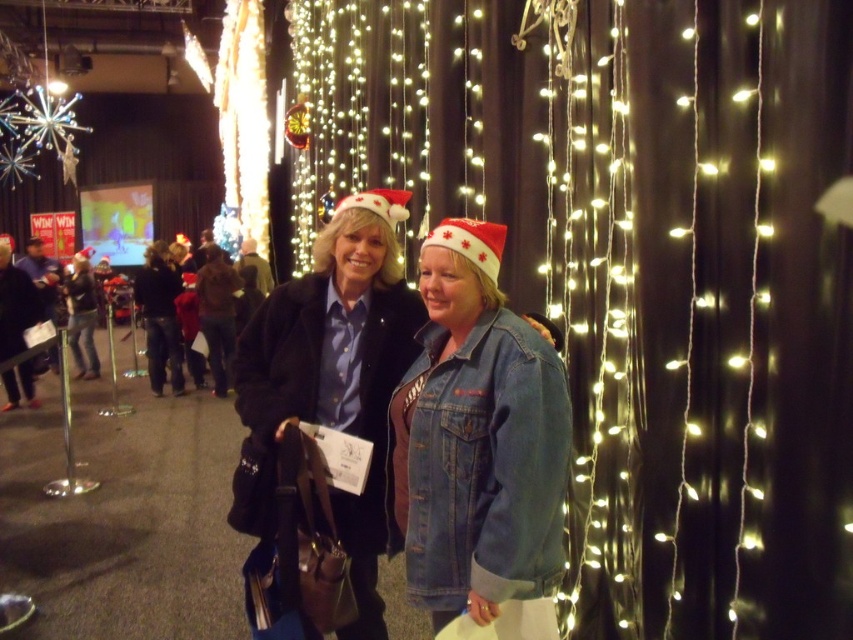
Question: Which point appears closest to the camera in this image?

Choices:
 (A) (x=392, y=346)
 (B) (x=479, y=509)

Answer: (B)

Question: Is denim jacket at lower right wider than denim jacket at center?

Choices:
 (A) yes
 (B) no

Answer: (B)

Question: Does denim jacket at lower right have a greater width compared to denim jacket at center?

Choices:
 (A) yes
 (B) no

Answer: (B)

Question: Is denim jacket at lower right above denim jacket at center?

Choices:
 (A) no
 (B) yes

Answer: (B)

Question: Which object is farther from the camera taking this photo?

Choices:
 (A) denim jacket at lower right
 (B) denim jacket at center

Answer: (B)